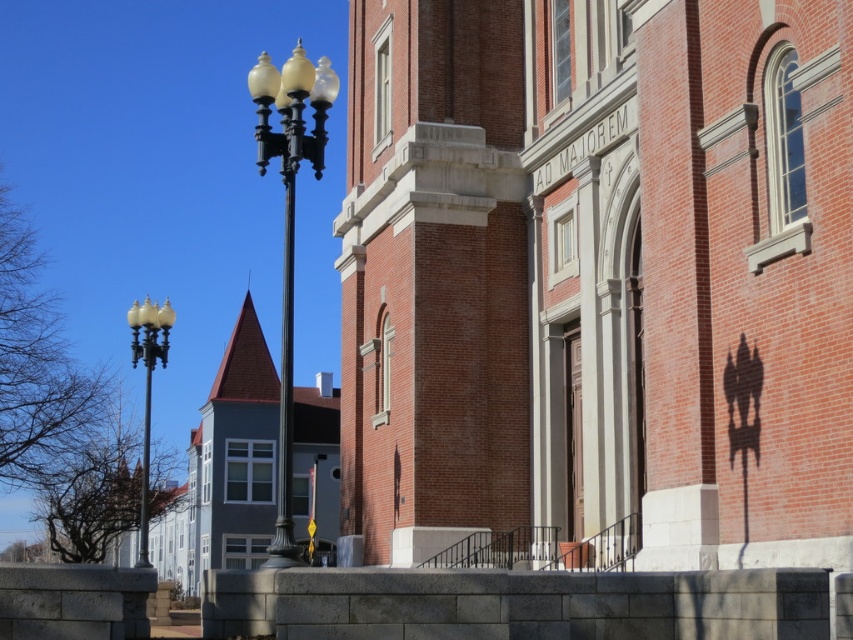
Does polished brass streetlight at left have a greater height compared to black metal pole at left?

Yes.

Between polished brass streetlight at left and black metal pole at left, which one has more height?

With more height is polished brass streetlight at left.

Between point (296, 160) and point (143, 547), which one is positioned in front?

Point (296, 160) is in front.

The width and height of the screenshot is (853, 640). I want to click on polished brass streetlight at left, so click(x=289, y=227).

Does polished brass streetlight at left have a larger size compared to black polished metal streetlight at center-left?

Correct, polished brass streetlight at left is larger in size than black polished metal streetlight at center-left.

Can you confirm if polished brass streetlight at left is smaller than black polished metal streetlight at center-left?

No, polished brass streetlight at left is not smaller than black polished metal streetlight at center-left.

Where is `polished brass streetlight at left`? The height and width of the screenshot is (640, 853). polished brass streetlight at left is located at coordinates (289, 227).

You are a GUI agent. You are given a task and a screenshot of the screen. Output one action in this format:
    pyautogui.click(x=<x>, y=<y>)
    Task: Click on the polished brass streetlight at left
    The image size is (853, 640).
    Given the screenshot: What is the action you would take?
    pyautogui.click(x=289, y=227)

Does black polished metal streetlight at center-left appear under matte black lamp post at left?

No, black polished metal streetlight at center-left is not below matte black lamp post at left.

Is black polished metal streetlight at center-left taller than matte black lamp post at left?

Correct, black polished metal streetlight at center-left is much taller as matte black lamp post at left.

Between point (288, 390) and point (143, 330), which one is positioned in front?

Positioned in front is point (288, 390).

Identify the location of black polished metal streetlight at center-left. click(285, 388).